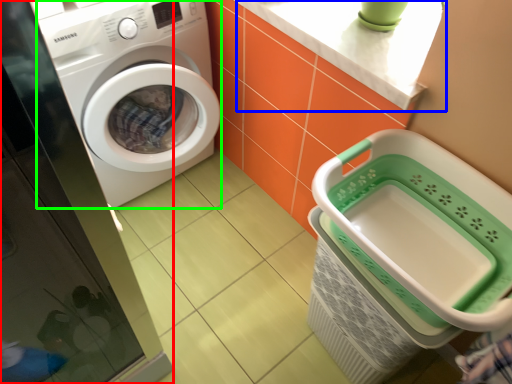
Question: Estimate the real-world distances between objects in this image. Which object is closer to screen door (highlighted by a red box), counter top (highlighted by a blue box) or washing machine (highlighted by a green box)?

Choices:
 (A) counter top
 (B) washing machine

Answer: (B)